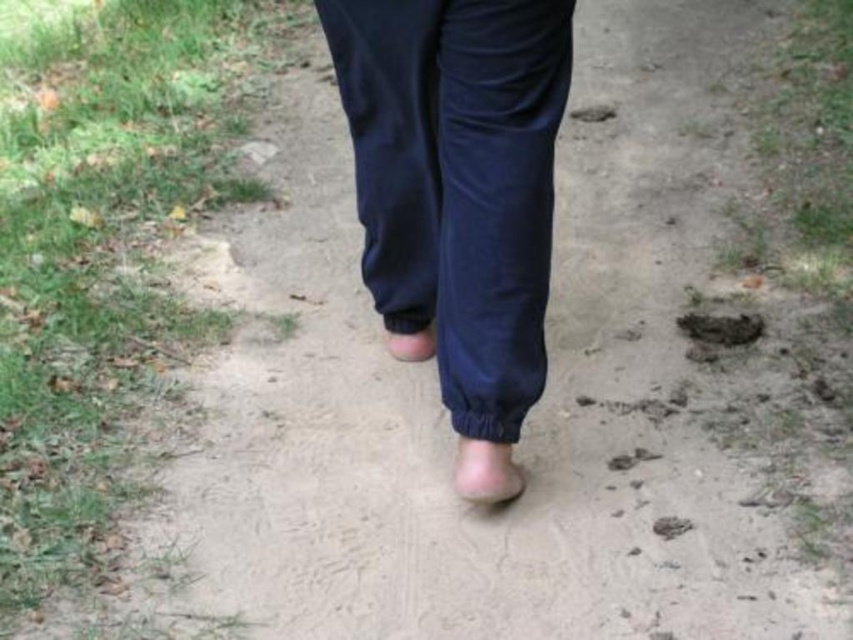
Does pink matte foot at center have a lesser height compared to brown dirt footprint at center?

No.

Who is taller, pink matte foot at center or brown dirt footprint at center?

Standing taller between the two is pink matte foot at center.

You are a GUI agent. You are given a task and a screenshot of the screen. Output one action in this format:
    pyautogui.click(x=<x>, y=<y>)
    Task: Click on the pink matte foot at center
    The width and height of the screenshot is (853, 640).
    Given the screenshot: What is the action you would take?
    pyautogui.click(x=485, y=472)

Which of these two, navy blue fabric pants at center or pink matte foot at center, stands shorter?

Standing shorter between the two is pink matte foot at center.

Who is more distant from viewer, (494, 115) or (508, 449)?

Point (508, 449)

Locate an element on the screen. The height and width of the screenshot is (640, 853). navy blue fabric pants at center is located at coordinates (457, 182).

Is point (451, 360) less distant than point (698, 328)?

Yes, point (451, 360) is in front of point (698, 328).

Is navy blue fabric pants at center below brown dirt footprint at lower right?

Incorrect, navy blue fabric pants at center is not positioned below brown dirt footprint at lower right.

Identify the location of navy blue fabric pants at center. (457, 182).